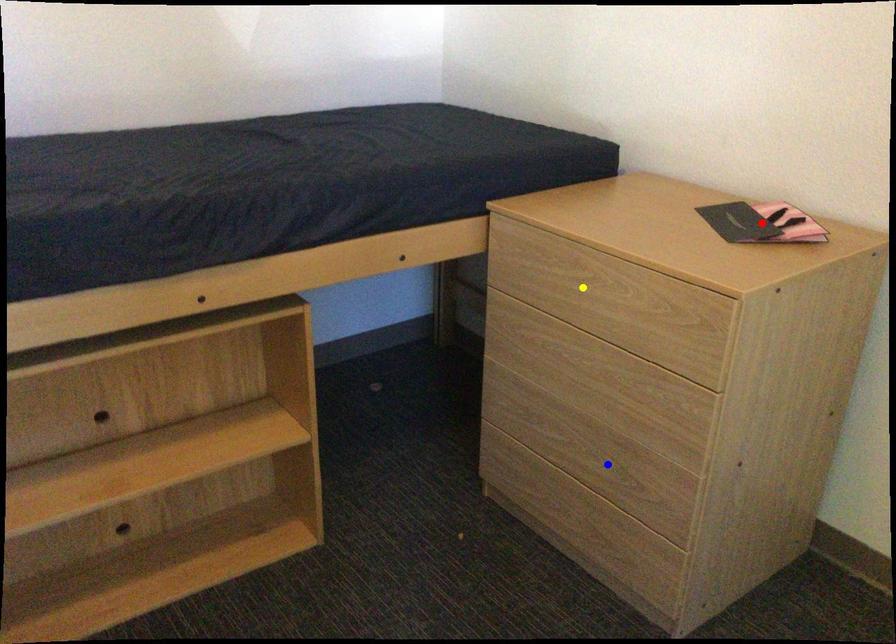
Order these from farthest to nearest:
red point | blue point | yellow point

yellow point, blue point, red point